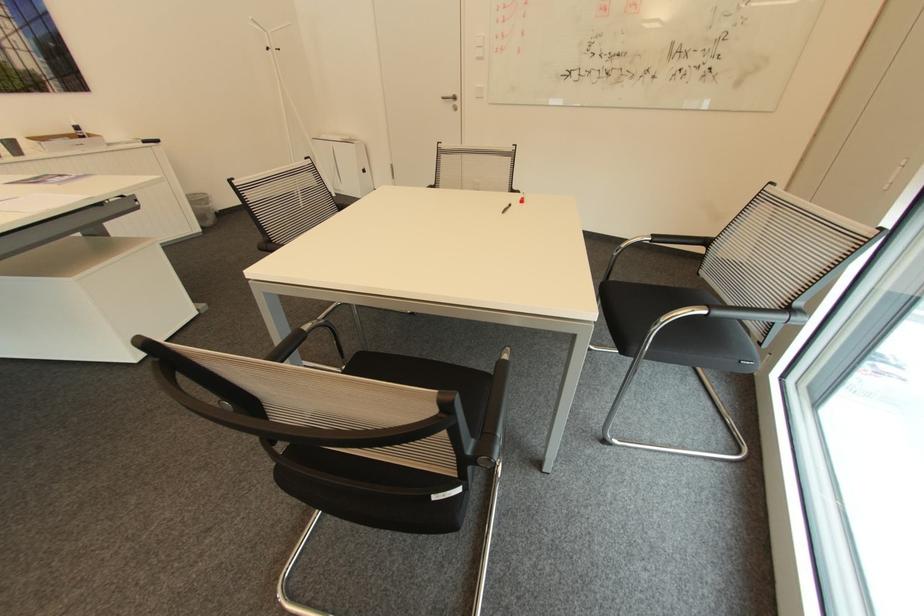
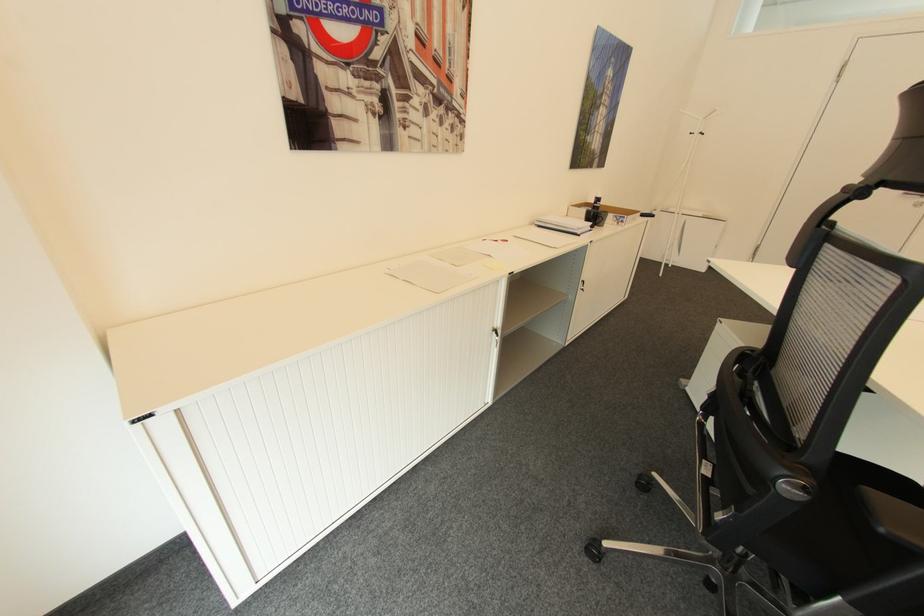
Question: The images are taken continuously from a first-person perspective. In which direction are you moving?

Choices:
 (A) Left
 (B) Right
 (C) Forward
 (D) Backward

Answer: (A)